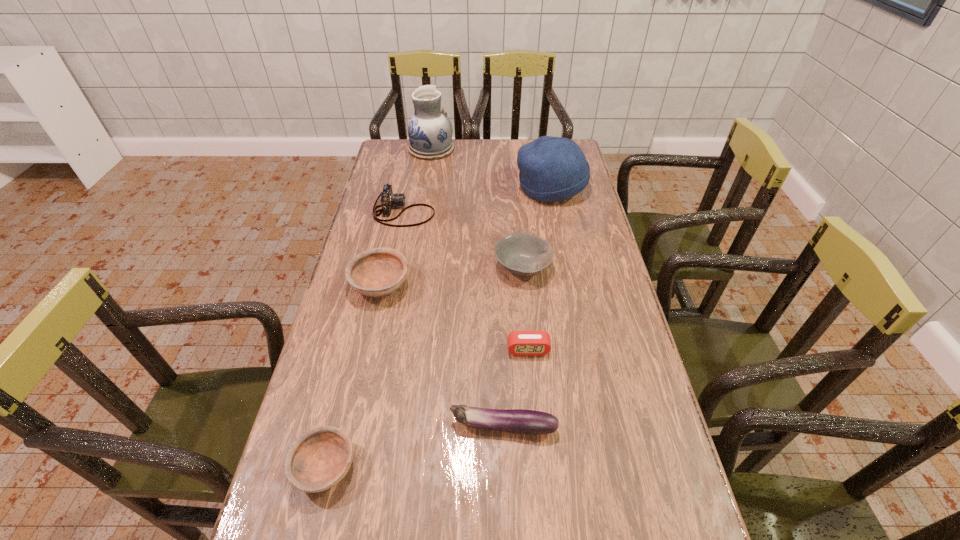
The height and width of the screenshot is (540, 960). What are the coordinates of `blue pottery` in the screenshot? It's located at (430, 131).

This screenshot has height=540, width=960. Find the location of `pottery`. pottery is located at coordinates (430, 131).

Identify the location of the second tallest object. The image size is (960, 540). (552, 169).

The image size is (960, 540). I want to click on the bigger brown bowl, so click(377, 272).

Locate an element on the screen. gray bowl is located at coordinates (522, 254).

You are a GUI agent. You are given a task and a screenshot of the screen. Output one action in this format:
    pyautogui.click(x=<x>, y=<y>)
    Task: Click on the camera
    Image resolution: width=960 pixels, height=540 pixels.
    Given the screenshot: What is the action you would take?
    pyautogui.click(x=388, y=199)

This screenshot has width=960, height=540. In order to click on eggplant in this screenshot , I will do 518,421.

In order to click on alarm clock in this screenshot , I will do `click(528, 343)`.

I want to click on the third nearest object, so click(x=528, y=343).

What are the coordinates of `the nearer brown bowl` in the screenshot? It's located at (319, 459).